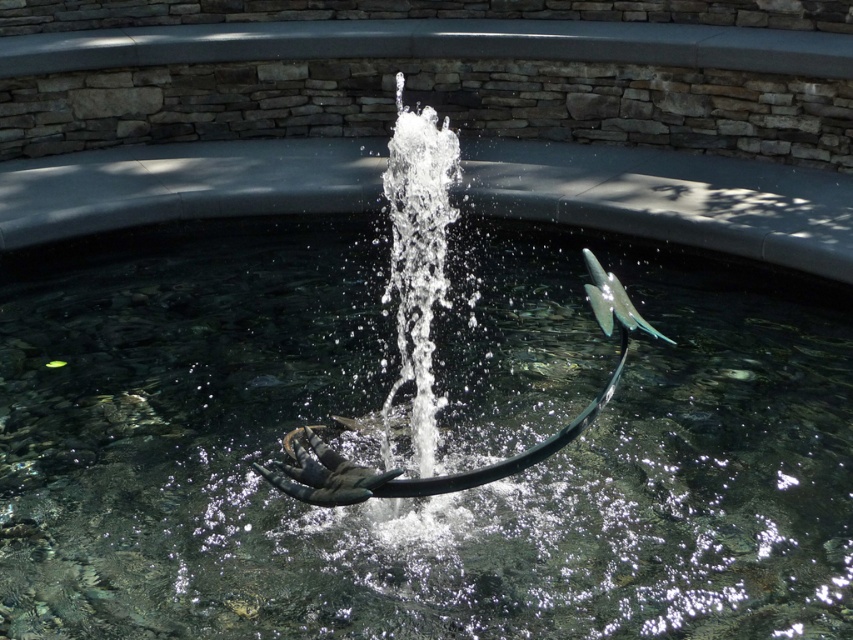
You are designing a layout for a garden and want to place a small bench. The bench requires a space that is wider than the metallic silver sculpture at center but narrower than the clear water at center. Is there enough space between them to place the bench?

The clear water at center has a larger size compared to the metallic silver sculpture at center. Since the bench needs to be wider than the metallic silver sculpture but narrower than the clear water, there is sufficient space between their sizes to accommodate the bench.

You are standing in the stone area around the fountain. You see the clear water at center and the metallic silver sculpture at center. Which one is positioned to the left of the other?

The clear water at center is to the left of the metallic silver sculpture at center.

You are designing a layout for a garden and want to place a bench so that it faces the fountain. The bench must be positioned such that the clear water at center is wider than the metallic silver sculpture at center. Based on the scene description, where should you place the bench relative to the fountain?

The clear water at center is already wider than the metallic silver sculpture at center. Therefore, placing the bench anywhere that faces the fountain will satisfy the requirement as the width relationship between the two objects is inherent to their design.